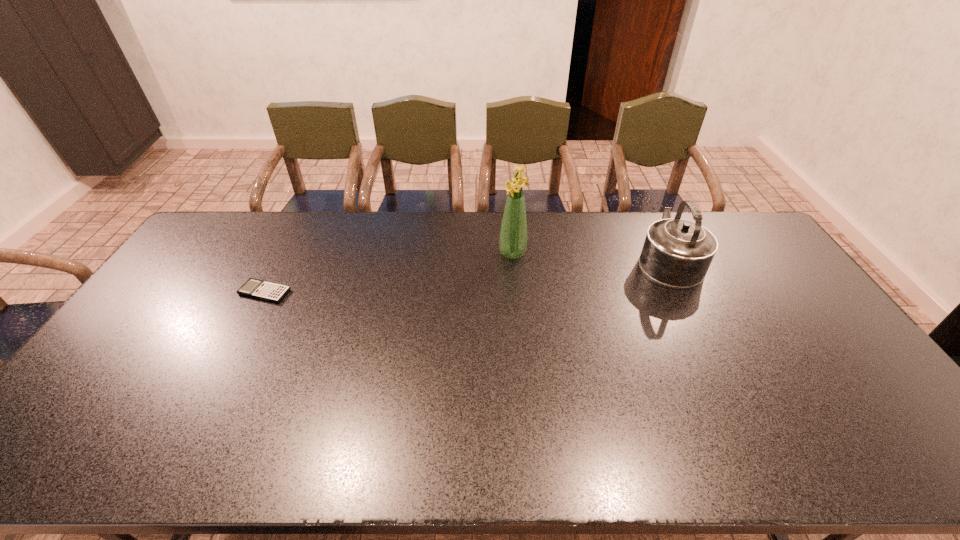
Where is `free area in between the leftmost object and the bouquet`? free area in between the leftmost object and the bouquet is located at coordinates (389, 273).

In order to click on free spot between the tallest object and the leftmost object in this screenshot , I will do [x=389, y=273].

Where is `free space between the kettle and the bouquet`? free space between the kettle and the bouquet is located at coordinates (590, 256).

Locate an element on the screen. free space between the rightmost object and the shortest object is located at coordinates (467, 276).

You are a GUI agent. You are given a task and a screenshot of the screen. Output one action in this format:
    pyautogui.click(x=<x>, y=<y>)
    Task: Click on the vacant region between the second object from left to right and the kettle
    
    Given the screenshot: What is the action you would take?
    pyautogui.click(x=590, y=256)

You are a GUI agent. You are given a task and a screenshot of the screen. Output one action in this format:
    pyautogui.click(x=<x>, y=<y>)
    Task: Click on the free space between the bouquet and the shortest object
    
    Given the screenshot: What is the action you would take?
    pyautogui.click(x=389, y=273)

Locate an element on the screen. This screenshot has width=960, height=540. free space between the kettle and the calculator is located at coordinates (467, 276).

The width and height of the screenshot is (960, 540). I want to click on vacant area that lies between the bouquet and the calculator, so click(389, 273).

At what (x,y) coordinates should I click in order to perform the action: click on the closest object relative to the second shortest object. Please return your answer as a coordinate pair (x, y). The width and height of the screenshot is (960, 540). Looking at the image, I should click on (513, 235).

Locate an element on the screen. the closest object relative to the second object from left to right is located at coordinates (677, 253).